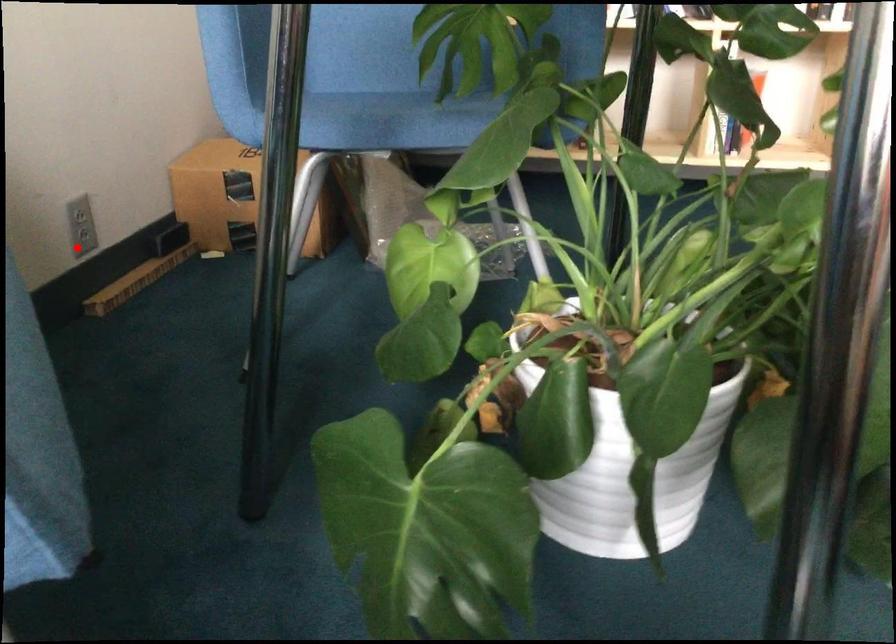
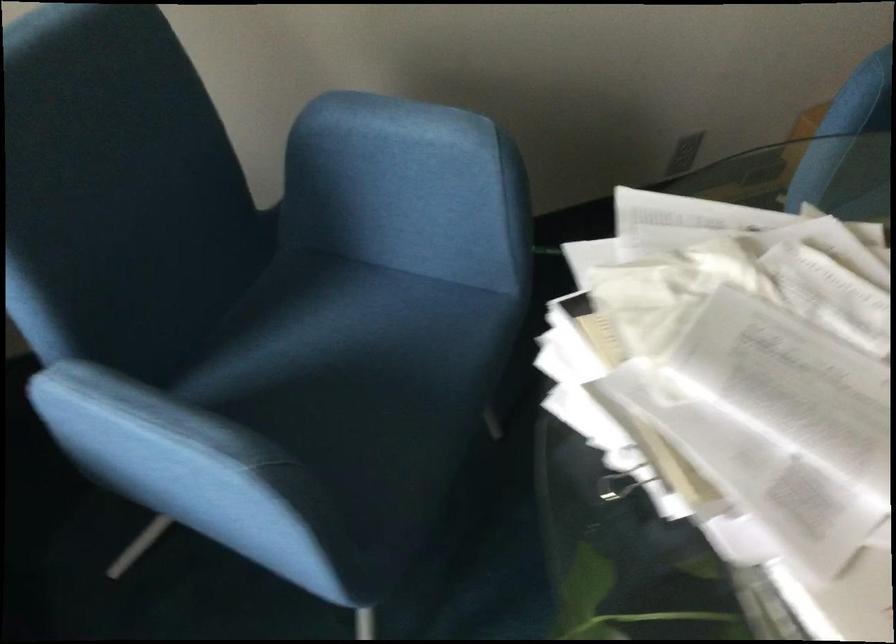
Find the pixel in the second image that matches the highlighted location in the first image.

(682, 158)